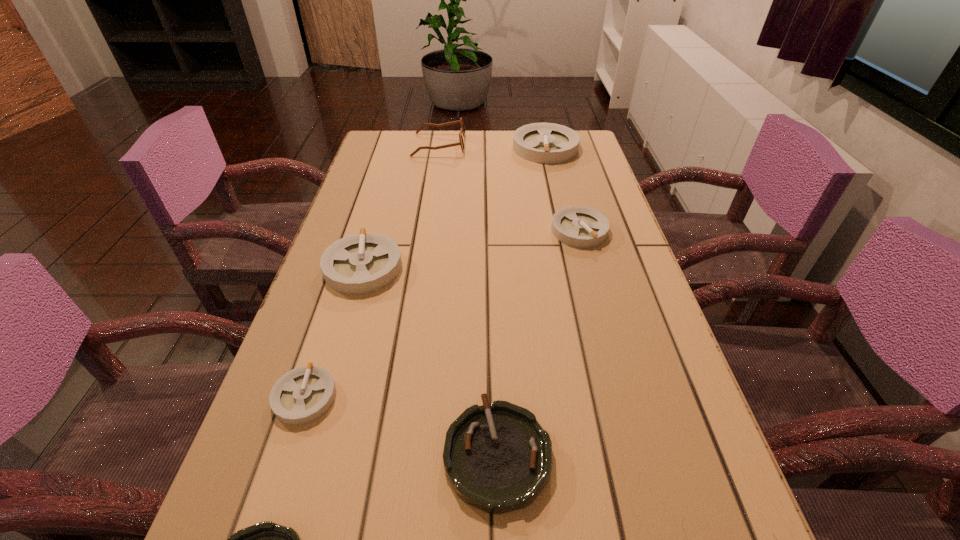
Where is `object located in the far right corner section of the desktop`? object located in the far right corner section of the desktop is located at coordinates (548, 143).

This screenshot has height=540, width=960. In the image, there is a desktop. In order to click on free space at the far edge in this screenshot , I will do `click(490, 132)`.

The width and height of the screenshot is (960, 540). Identify the location of free space at the left edge of the desktop. (372, 323).

The image size is (960, 540). In the image, there is a desktop. Identify the location of vacant region at the right edge. (643, 346).

The width and height of the screenshot is (960, 540). I want to click on blank space at the far left corner of the desktop, so click(377, 145).

Find the location of `free point between the bigger green ashtray and the third tallest ashtray`. free point between the bigger green ashtray and the third tallest ashtray is located at coordinates (539, 342).

Where is `free space between the fourth shortest ashtray and the right green ashtray`? The height and width of the screenshot is (540, 960). free space between the fourth shortest ashtray and the right green ashtray is located at coordinates (539, 342).

Where is `vacant space that's between the farthest gray ashtray and the second tallest ashtray`? This screenshot has width=960, height=540. vacant space that's between the farthest gray ashtray and the second tallest ashtray is located at coordinates (454, 207).

Identify the location of the sixth closest object to the bigger green ashtray. Image resolution: width=960 pixels, height=540 pixels. (462, 131).

Choose which object is the sixth nearest neighbor to the farther green ashtray. Please provide its 2D coordinates. Your answer should be formatted as a tuple, i.e. [(x, y)], where the tuple contains the x and y coordinates of a point satisfying the conditions above.

[(462, 131)]